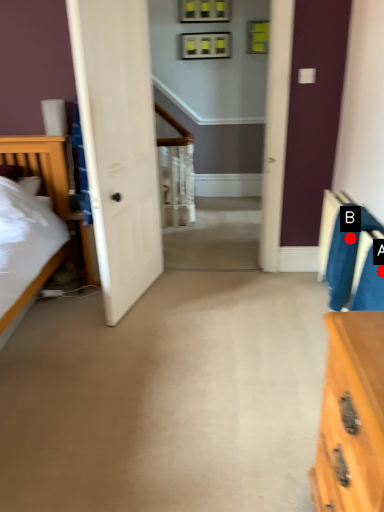
Question: Two points are circled on the image, labeled by A and B beside each circle. Which of the following is the farthest from the observer?

Choices:
 (A) A is further
 (B) B is further

Answer: (B)